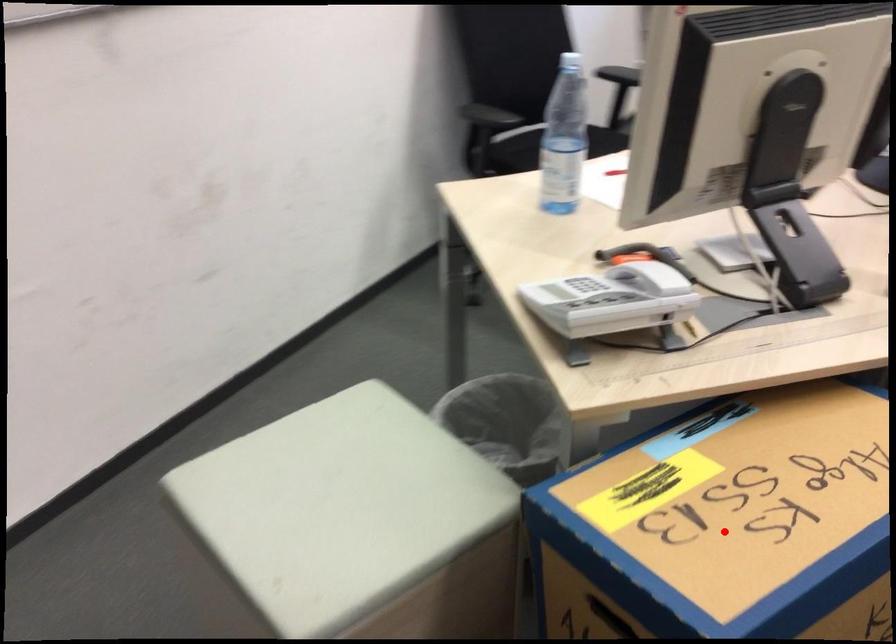
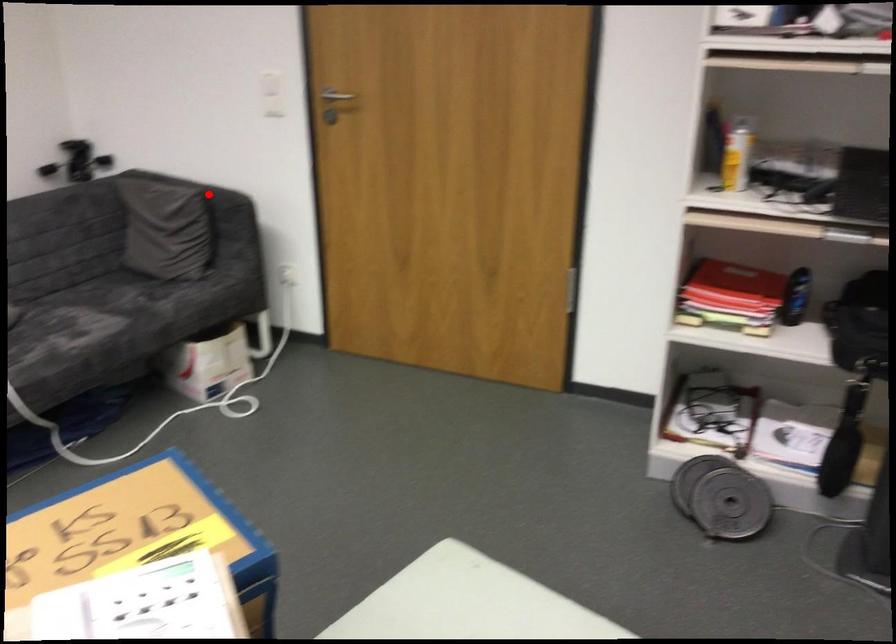
I am providing you with two images of the same scene from different viewpoints. A red point is marked on the first image and another point is marked on the second image. Is the marked point in image1 the same physical position as the marked point in image2?

No